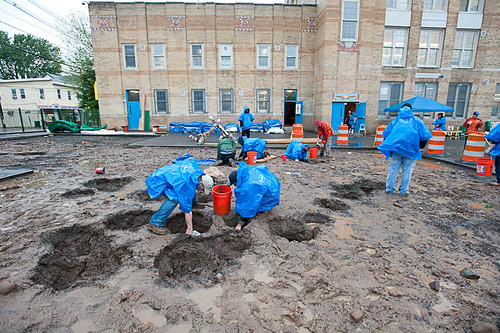
Identify the location of first floor windows. Image resolution: width=500 pixels, height=333 pixels. (165, 109), (205, 103), (226, 103), (393, 96), (455, 100), (425, 94).